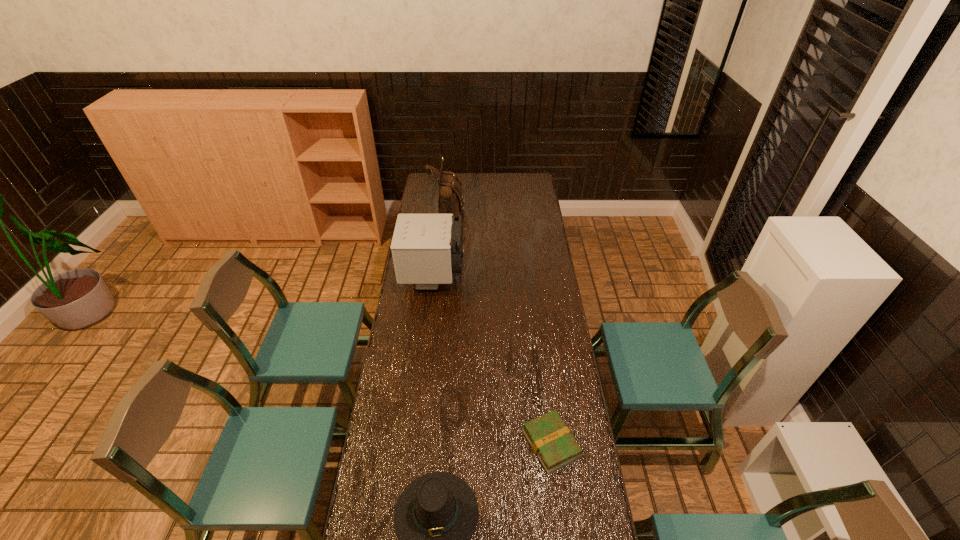
Identify the location of shoulder bag. This screenshot has width=960, height=540. (450, 201).

The height and width of the screenshot is (540, 960). Find the location of `fan`. fan is located at coordinates (427, 249).

The height and width of the screenshot is (540, 960). What are the coordinates of `book` in the screenshot? It's located at (551, 440).

This screenshot has height=540, width=960. What are the coordinates of `the rightmost object` in the screenshot? It's located at coord(551,440).

The width and height of the screenshot is (960, 540). Find the location of `vacant region located on the front-facing side of the farthest object`. vacant region located on the front-facing side of the farthest object is located at coordinates [x=523, y=208].

I want to click on free space located on the back of the fan, so click(x=437, y=247).

Image resolution: width=960 pixels, height=540 pixels. What are the coordinates of `vacant point located 0.310m on the back of the shortest object` in the screenshot? It's located at (540, 348).

The height and width of the screenshot is (540, 960). Find the location of `shoulder bag at the left edge`. shoulder bag at the left edge is located at coordinates (450, 201).

Identify the location of fan present at the left edge. (427, 249).

The height and width of the screenshot is (540, 960). In order to click on object that is at the right edge in this screenshot , I will do `click(551, 440)`.